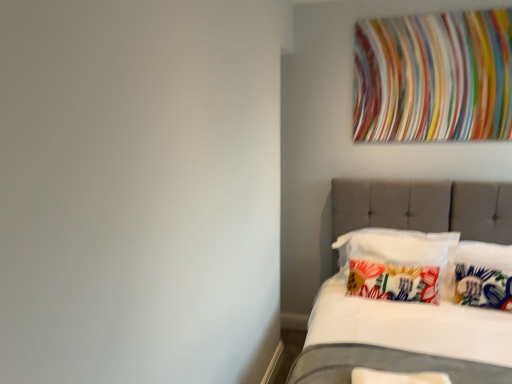
Question: From the image's perspective, is white soft pillow at lower right, the 4th pillow in the back-to-front sequence, positioned above or below printed fabric pillow at center, positioned as the first pillow in back-to-front order?

Choices:
 (A) below
 (B) above

Answer: (A)

Question: Considering their positions, is white soft pillow at lower right, the 4th pillow in the back-to-front sequence, located in front of or behind printed fabric pillow at center, positioned as the 4th pillow in front-to-back order?

Choices:
 (A) behind
 (B) front

Answer: (B)

Question: Which object is the farthest from the multicolored fabric at upper right?

Choices:
 (A) floral fabric pillow at right, acting as the 3th pillow starting from the back
 (B) white soft pillow at lower right, marked as the first pillow in a front-to-back arrangement
 (C) tufted fabric bed at right
 (D) floral fabric pillow at center, arranged as the third pillow when viewed from the front
 (E) printed fabric pillow at center, positioned as the first pillow in back-to-front order

Answer: (B)

Question: Considering the real-world distances, which object is closest to the white soft pillow at lower right, the 4th pillow in the back-to-front sequence?

Choices:
 (A) tufted fabric bed at right
 (B) floral fabric pillow at right, acting as the 3th pillow starting from the back
 (C) multicolored fabric at upper right
 (D) printed fabric pillow at center, positioned as the first pillow in back-to-front order
 (E) floral fabric pillow at center, arranged as the third pillow when viewed from the front

Answer: (E)